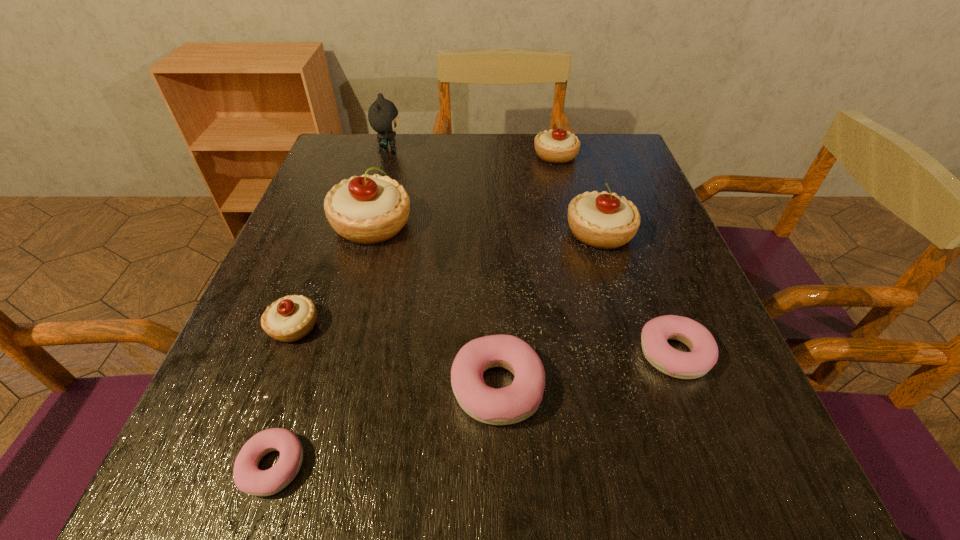
Locate an element on the screen. The height and width of the screenshot is (540, 960). blank region between the second tallest pastry and the fourth shortest pastry is located at coordinates (446, 280).

You are a GUI agent. You are given a task and a screenshot of the screen. Output one action in this format:
    pyautogui.click(x=<x>, y=<y>)
    Task: Click on the vacant space that is in between the third shortest pastry and the tallest pastry
    
    Given the screenshot: What is the action you would take?
    pyautogui.click(x=435, y=306)

Find the location of a particular element. The image size is (960, 540). free space that is in between the second tallest pastry and the biggest pink pastry is located at coordinates [x=548, y=309].

You are a GUI agent. You are given a task and a screenshot of the screen. Output one action in this format:
    pyautogui.click(x=<x>, y=<y>)
    Task: Click on the free space between the fourth pastry from right to left and the gray kitten
    This screenshot has height=540, width=960.
    Given the screenshot: What is the action you would take?
    pyautogui.click(x=444, y=268)

The height and width of the screenshot is (540, 960). I want to click on object that is the closest to the leftmost pink pastry, so click(290, 318).

Find the location of `object that can be found as the closest to the farthest beige pastry`. object that can be found as the closest to the farthest beige pastry is located at coordinates (601, 220).

Identify the location of the second closest pastry to the rightmost pink pastry. (601, 220).

Identify which pastry is the second closest to the second tallest pastry. Please provide its 2D coordinates. Your answer should be formatted as a tuple, i.e. [(x, y)], where the tuple contains the x and y coordinates of a point satisfying the conditions above.

[(558, 146)]

Identify which beige pastry is located as the nearest to the sixth shortest object. Please provide its 2D coordinates. Your answer should be formatted as a tuple, i.e. [(x, y)], where the tuple contains the x and y coordinates of a point satisfying the conditions above.

[(558, 146)]

Identify which beige pastry is the fourth closest to the kitten. Please provide its 2D coordinates. Your answer should be formatted as a tuple, i.e. [(x, y)], where the tuple contains the x and y coordinates of a point satisfying the conditions above.

[(290, 318)]